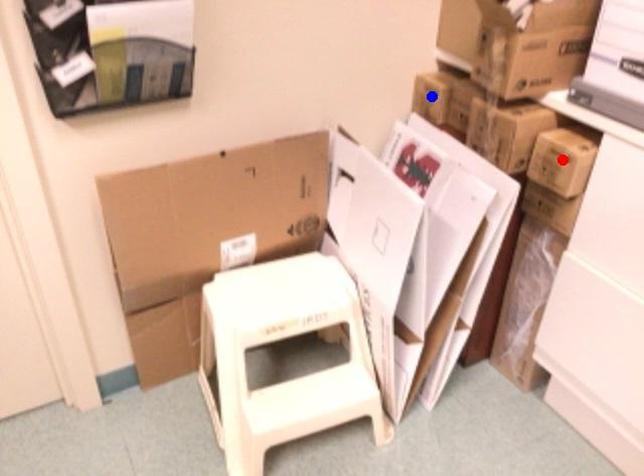
Question: Two points are marked on the image. Which point is closer to the camera?

Choices:
 (A) Blue point is closer.
 (B) Red point is closer.

Answer: (B)